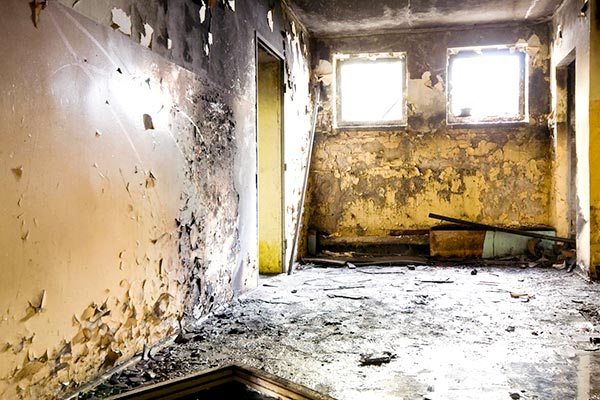
This screenshot has height=400, width=600. Identify the location of hinge. (283, 86), (280, 165), (280, 244).